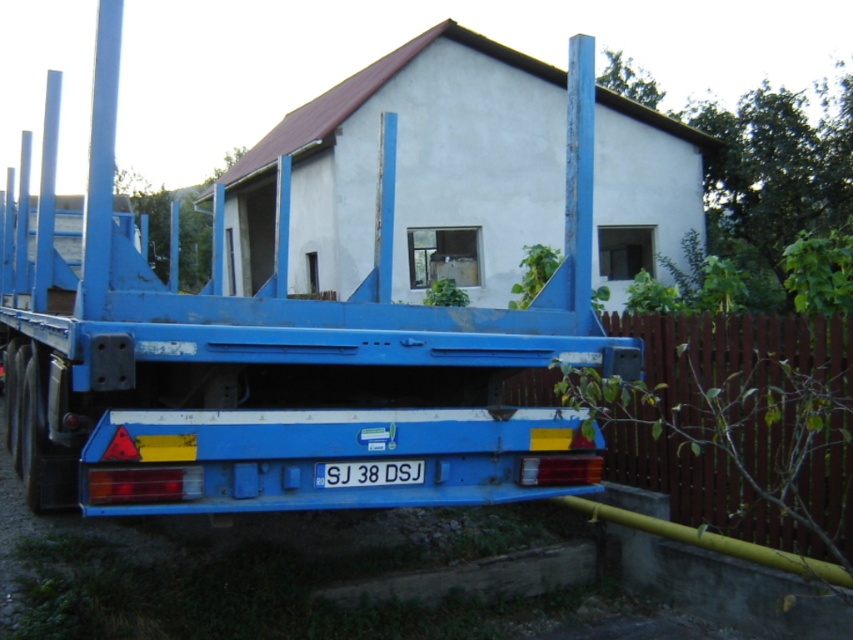
You are standing at the front of the white house with a sloped red roof. You see a point marked at coordinates (283, 356). What object is located at that point?

The point at coordinates (283, 356) marks the location of the blue metallic trailer truck at center.

You are standing in front of the blue flatbed trailer parked in front of the white house with a sloped red roof. You see two points marked on the trailer. The first point is at coordinate point (146, 435) and the second is at point (325, 481). Which point is closer to you?

Point (146, 435) is closer to the viewer than point (325, 481).